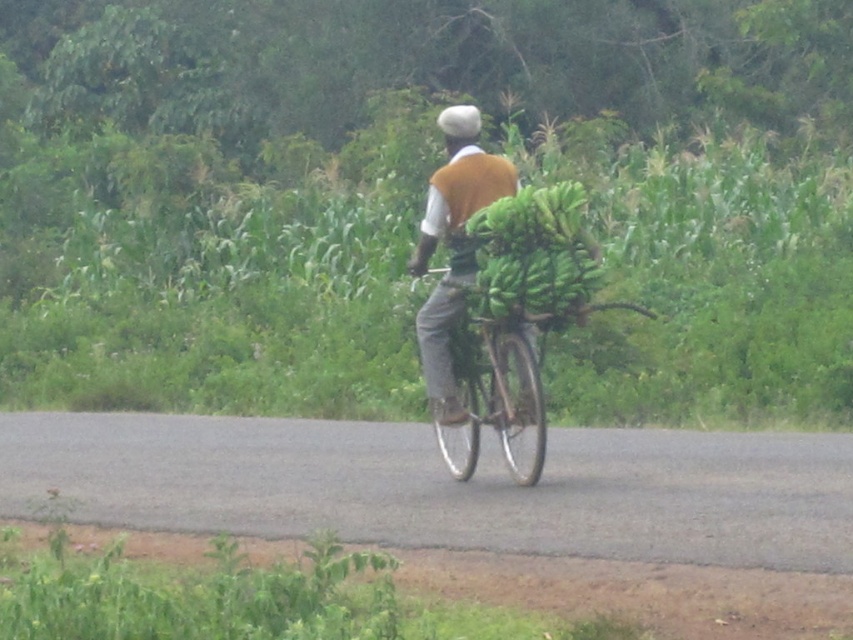
Question: Does orange fabric at center appear over metallic silver bicycle at center?

Choices:
 (A) no
 (B) yes

Answer: (B)

Question: Does green matte bananas at center have a smaller size compared to metallic silver bicycle at center?

Choices:
 (A) no
 (B) yes

Answer: (B)

Question: Among these objects, which one is farthest from the camera?

Choices:
 (A) orange fabric at center
 (B) green matte bananas at center
 (C) metallic silver bicycle at center

Answer: (A)

Question: Which object appears closest to the camera in this image?

Choices:
 (A) green matte bananas at center
 (B) orange fabric at center
 (C) metallic silver bicycle at center

Answer: (A)

Question: Where is green matte bananas at center located in relation to metallic silver bicycle at center in the image?

Choices:
 (A) left
 (B) right

Answer: (B)

Question: Which object is the closest to the metallic silver bicycle at center?

Choices:
 (A) orange fabric at center
 (B) green matte bananas at center

Answer: (A)